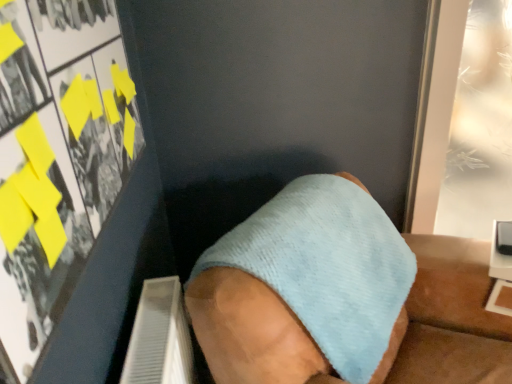
Question: Can you confirm if transparent glass door at upper right, the first poster page positioned from the right, is taller than light blue fabric sock at center?

Choices:
 (A) no
 (B) yes

Answer: (B)

Question: Can you confirm if transparent glass door at upper right, the first poster page positioned from the right, is bigger than light blue fabric sock at center?

Choices:
 (A) yes
 (B) no

Answer: (B)

Question: From a real-world perspective, is transparent glass door at upper right, placed as the 1th poster page when sorted from back to front, beneath light blue fabric sock at center?

Choices:
 (A) no
 (B) yes

Answer: (A)

Question: Is transparent glass door at upper right, placed as the 1th poster page when sorted from back to front, aimed at light blue fabric sock at center?

Choices:
 (A) yes
 (B) no

Answer: (B)

Question: Can you confirm if transparent glass door at upper right, the 2th poster page when ordered from left to right, is shorter than light blue fabric sock at center?

Choices:
 (A) no
 (B) yes

Answer: (A)

Question: In terms of width, does light blue fabric sock at center look wider or thinner when compared to matte paper poster at upper left, the first poster page positioned from the left?

Choices:
 (A) wide
 (B) thin

Answer: (A)

Question: From the image's perspective, is light blue fabric sock at center located above or below matte paper poster at upper left, the first poster page positioned from the left?

Choices:
 (A) above
 (B) below

Answer: (B)

Question: Would you say light blue fabric sock at center is inside or outside matte paper poster at upper left, the 2th poster page when ordered from back to front?

Choices:
 (A) inside
 (B) outside

Answer: (B)

Question: Considering the positions of point (269, 360) and point (117, 153), is point (269, 360) closer or farther from the camera than point (117, 153)?

Choices:
 (A) farther
 (B) closer

Answer: (B)

Question: Would you say transparent glass door at upper right, placed as the 1th poster page when sorted from back to front, is to the left or to the right of matte paper poster at upper left, arranged as the 1th poster page when viewed from the front, in the picture?

Choices:
 (A) right
 (B) left

Answer: (A)

Question: Is transparent glass door at upper right, placed as the 2th poster page when sorted from front to back, inside or outside of matte paper poster at upper left, the first poster page positioned from the left?

Choices:
 (A) inside
 (B) outside

Answer: (B)

Question: From the image's perspective, is transparent glass door at upper right, the 2th poster page when ordered from left to right, located above or below matte paper poster at upper left, positioned as the second poster page in right-to-left order?

Choices:
 (A) above
 (B) below

Answer: (A)

Question: Is point (477, 41) positioned closer to the camera than point (23, 165)?

Choices:
 (A) farther
 (B) closer

Answer: (A)

Question: Considering the positions of matte paper poster at upper left, arranged as the 1th poster page when viewed from the front, and light blue fabric sock at center in the image, is matte paper poster at upper left, arranged as the 1th poster page when viewed from the front, wider or thinner than light blue fabric sock at center?

Choices:
 (A) wide
 (B) thin

Answer: (B)

Question: Is matte paper poster at upper left, arranged as the 1th poster page when viewed from the front, inside or outside of light blue fabric sock at center?

Choices:
 (A) inside
 (B) outside

Answer: (B)